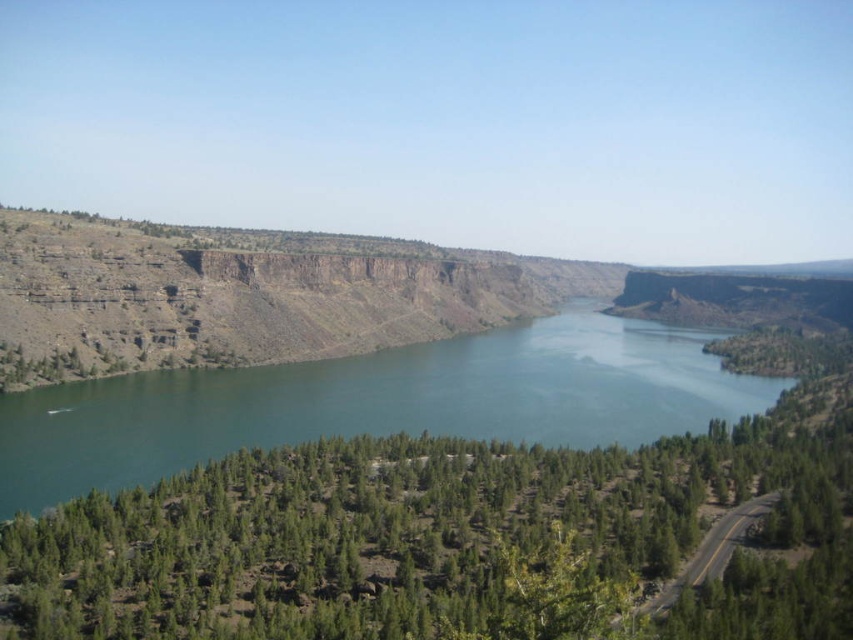
Question: Which point is farther from the camera taking this photo?

Choices:
 (A) (730, 458)
 (B) (186, 432)

Answer: (B)

Question: Can you confirm if green leafy trees at center is smaller than green water at center?

Choices:
 (A) no
 (B) yes

Answer: (B)

Question: Can you confirm if green leafy trees at center is bigger than green water at center?

Choices:
 (A) no
 (B) yes

Answer: (A)

Question: Is green leafy trees at center positioned before green water at center?

Choices:
 (A) no
 (B) yes

Answer: (B)

Question: Which of the following is the farthest from the observer?

Choices:
 (A) (456, 632)
 (B) (351, 364)

Answer: (B)

Question: Which of the following is the farthest from the observer?

Choices:
 (A) (70, 529)
 (B) (541, 392)

Answer: (B)